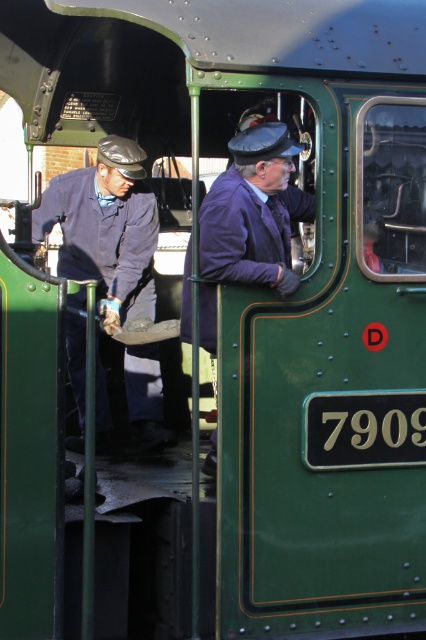
You are a photographer positioned at the center of the scene. You want to capture a photo of the blue fabric uniform at center. Which direction should you aim your camera to ensure the uniform is in the frame?

The blue fabric uniform at center is already at the center of the scene, so you should aim your camera directly forward to capture it in the frame.

You are standing at the point marked as point (106, 227) in the image. What is the closest object to you?

The closest object to you at point (106, 227) is the blue fabric uniform at center.

Looking at this image, you are a costume designer preparing for a historical railway play. You have two costumes available in the wardrobe room. One is the blue fabric uniform at center, and the other is the purple woolen jacket at center. The director wants to ensure that the actor wearing the wider costume will stand out more in the scene. Which costume should the actor wear?

The blue fabric uniform at center is wider than the purple woolen jacket at center. Therefore, the actor should wear the blue fabric uniform at center to stand out more due to its greater width.